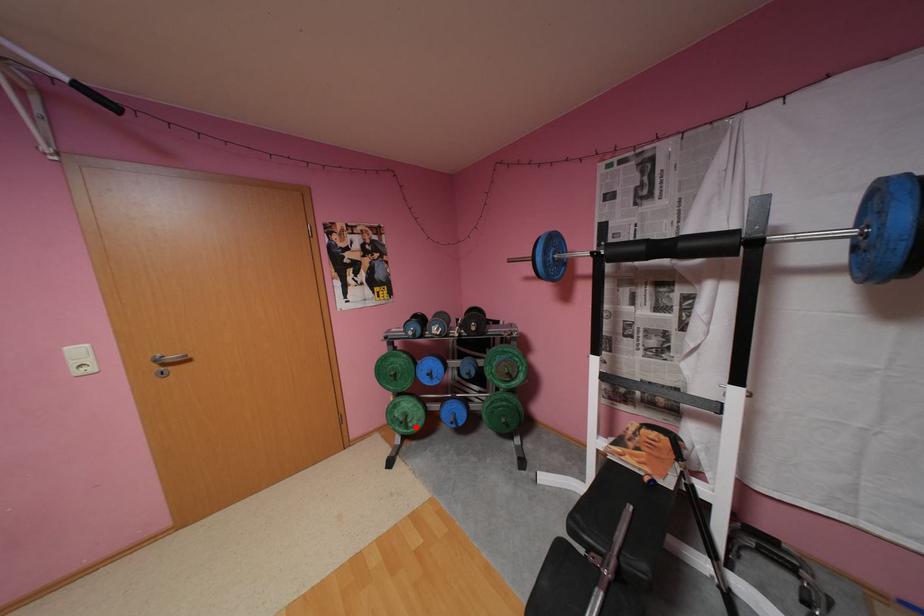
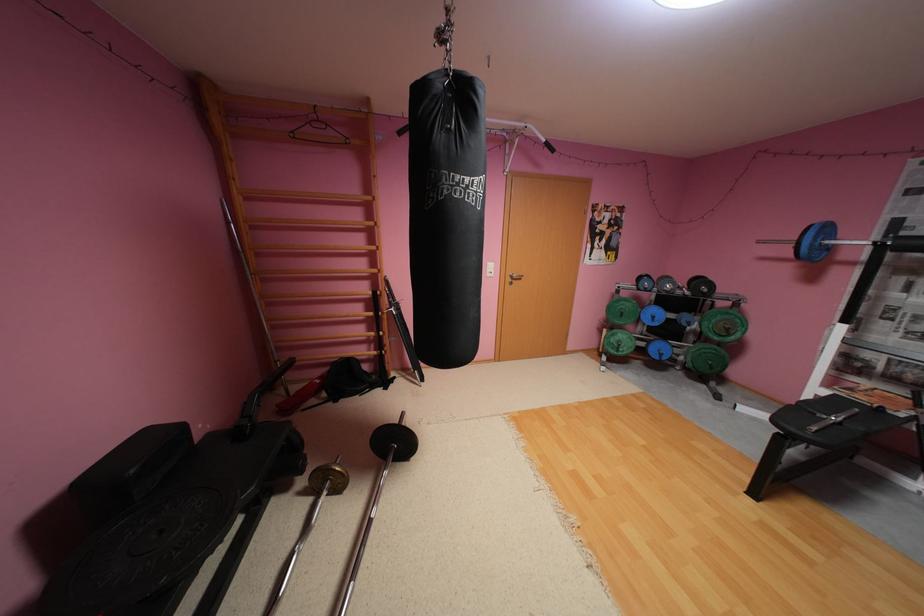
Question: A red point is marked in image1. In image2, is the corresponding 3D point closer to the camera or farther? Reply with the corresponding letter.

Choices:
 (A) The corresponding 3D point is closer.
 (B) The corresponding 3D point is farther.

Answer: (A)